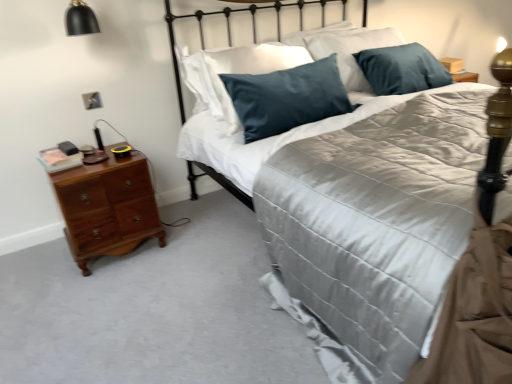
What is the approximate width of black matte lampshade at upper left?

9.57 inches.

The width and height of the screenshot is (512, 384). Find the location of `matte silver outlet at lower left`. matte silver outlet at lower left is located at coordinates (92, 100).

In order to face satin black headboard at upper center, should I rotate leftwards or rightwards?

It's best to rotate right around 2.399 degrees.

Locate an element on the screen. satin gray bed at center is located at coordinates (373, 224).

Find the location of a particular element. This screenshot has height=384, width=512. bed above the cherry wood nightstand at left (from the image's perspective) is located at coordinates (373, 224).

From the image's perspective, does cherry wood nightstand at left appear lower than satin gray bed at center?

Indeed, from the image's perspective, cherry wood nightstand at left is shown beneath satin gray bed at center.

Which point is more distant from viewer, (120,219) or (329,322)?

The point (120,219) is behind.

Between cherry wood nightstand at left and satin gray bed at center, which one has smaller size?

cherry wood nightstand at left.

Considering the positions of point (330, 247) and point (80, 33), is point (330, 247) closer or farther from the camera than point (80, 33)?

Point (330, 247) appears to be closer to the viewer than point (80, 33).

Is satin gray bed at center shorter than black matte lampshade at upper left?

No.

Considering their positions, is satin gray bed at center located in front of or behind black matte lampshade at upper left?

Visually, satin gray bed at center is located in front of black matte lampshade at upper left.

From a real-world perspective, is matte silver outlet at lower left physically located above or below satin gray bed at center?

From a real-world perspective, matte silver outlet at lower left is physically above satin gray bed at center.

In terms of size, does matte silver outlet at lower left appear bigger or smaller than satin gray bed at center?

Clearly, matte silver outlet at lower left is smaller in size than satin gray bed at center.

You are a GUI agent. You are given a task and a screenshot of the screen. Output one action in this format:
    pyautogui.click(x=<x>, y=<y>)
    Task: Click on the bed below the matte silver outlet at lower left (from a real-world perspective)
    Image resolution: width=512 pixels, height=384 pixels.
    Given the screenshot: What is the action you would take?
    point(373,224)

Between matte silver outlet at lower left and satin gray bed at center, which one has smaller width?

Thinner between the two is matte silver outlet at lower left.

What are the coordinates of `headboard located above the satin gray bed at center (from a real-world perspective)` in the screenshot? It's located at (230, 27).

Which of these two, satin black headboard at upper center or satin gray bed at center, is smaller?

satin black headboard at upper center.

Which is less distant, (169, 37) or (367, 304)?

The point (367, 304) is in front.

Find the location of a particular element. The height and width of the screenshot is (384, 512). headboard below the black matte lampshade at upper left (from the image's perspective) is located at coordinates (230, 27).

Is satin black headboard at upper center at the back of black matte lampshade at upper left?

No, black matte lampshade at upper left's orientation is not away from satin black headboard at upper center.

Does black matte lampshade at upper left appear on the left side of satin black headboard at upper center?

Yes.

Measure the distance between black matte lampshade at upper left and satin black headboard at upper center.

black matte lampshade at upper left is 71.71 centimeters from satin black headboard at upper center.

Which object is further away from the camera taking this photo, matte silver outlet at lower left or satin black headboard at upper center?

matte silver outlet at lower left is more distant.

Considering the relative sizes of matte silver outlet at lower left and satin black headboard at upper center in the image provided, is matte silver outlet at lower left wider than satin black headboard at upper center?

No, matte silver outlet at lower left is not wider than satin black headboard at upper center.

Can we say matte silver outlet at lower left lies outside satin black headboard at upper center?

matte silver outlet at lower left is positioned outside satin black headboard at upper center.

Between point (91, 105) and point (203, 39), which one is positioned in front?

The point (91, 105) is closer to the camera.

Which is behind, cherry wood nightstand at left or satin black headboard at upper center?

cherry wood nightstand at left is more distant.

Are cherry wood nightstand at left and satin black headboard at upper center located far from each other?

No.

From the image's perspective, which is above, cherry wood nightstand at left or satin black headboard at upper center?

satin black headboard at upper center.

Which of these two, cherry wood nightstand at left or satin black headboard at upper center, stands shorter?

cherry wood nightstand at left.

I want to click on nightstand to the left of satin gray bed at center, so click(x=106, y=207).

Identify the location of bed located underneath the black matte lampshade at upper left (from a real-world perspective). This screenshot has width=512, height=384. (373, 224).

Which object lies further to the anchor point satin gray bed at center, black matte lampshade at upper left or cherry wood nightstand at left?

Based on the image, black matte lampshade at upper left appears to be further to satin gray bed at center.

Which object lies further to the anchor point cherry wood nightstand at left, satin gray bed at center or matte silver outlet at lower left?

The object further to cherry wood nightstand at left is satin gray bed at center.

Considering their positions, is matte silver outlet at lower left positioned further to cherry wood nightstand at left than satin black headboard at upper center?

satin black headboard at upper center.

From the image, which object appears to be farther from cherry wood nightstand at left, satin black headboard at upper center or black matte lampshade at upper left?

black matte lampshade at upper left is further to cherry wood nightstand at left.

From the image, which object appears to be farther from cherry wood nightstand at left, black matte lampshade at upper left or satin gray bed at center?

satin gray bed at center lies further to cherry wood nightstand at left than the other object.

Which object lies nearer to the anchor point black matte lampshade at upper left, satin black headboard at upper center or matte silver outlet at lower left?

matte silver outlet at lower left.

Based on their spatial positions, is satin black headboard at upper center or cherry wood nightstand at left further from black matte lampshade at upper left?

Based on the image, cherry wood nightstand at left appears to be further to black matte lampshade at upper left.

Estimate the real-world distances between objects in this image. Which object is closer to matte silver outlet at lower left, black matte lampshade at upper left or satin black headboard at upper center?

black matte lampshade at upper left is closer to matte silver outlet at lower left.

This screenshot has height=384, width=512. In order to click on nightstand between matte silver outlet at lower left and satin gray bed at center from left to right in this screenshot , I will do `click(106, 207)`.

This screenshot has width=512, height=384. Find the location of `headboard between black matte lampshade at upper left and satin gray bed at center from left to right`. headboard between black matte lampshade at upper left and satin gray bed at center from left to right is located at coordinates (230, 27).

This screenshot has width=512, height=384. Identify the location of headboard between cherry wood nightstand at left and satin gray bed at center from left to right. (230, 27).

This screenshot has height=384, width=512. Identify the location of headboard between matte silver outlet at lower left and satin gray bed at center from left to right. (230, 27).